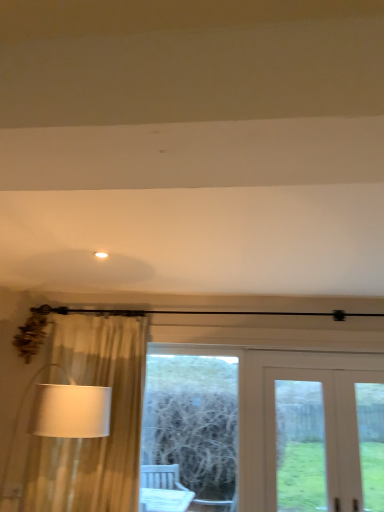
Image resolution: width=384 pixels, height=512 pixels. Identify the location of white wooden door at center. coord(306,420).

The width and height of the screenshot is (384, 512). What do you see at coordinates (306, 420) in the screenshot?
I see `white wooden door at center` at bounding box center [306, 420].

Identify the location of wooden frame at center. (190, 433).

Consider the image. Which of these two, white matte light fixture at upper center or white fabric lampshade at left, is bigger?

white fabric lampshade at left is bigger.

Do you think white matte light fixture at upper center is within white fabric lampshade at left, or outside of it?

white matte light fixture at upper center is spatially situated outside white fabric lampshade at left.

Is there a large distance between white matte light fixture at upper center and white fabric lampshade at left?

No, there isn't a large distance between white matte light fixture at upper center and white fabric lampshade at left.

From the image's perspective, which is below, white matte light fixture at upper center or white fabric lampshade at left?

white fabric lampshade at left, from the image's perspective.

Is white wooden door at center shorter than white fabric lampshade at left?

No.

The image size is (384, 512). Identify the location of table lamp on the left of white wooden door at center. (71, 411).

Is white wooden door at center outside of white fabric lampshade at left?

That's correct, white wooden door at center is outside of white fabric lampshade at left.

How different are the orientations of white fabric lampshade at left and wooden frame at center in degrees?

The facing directions of white fabric lampshade at left and wooden frame at center are 2.8 degrees apart.

Is there a large distance between white fabric lampshade at left and wooden frame at center?

Absolutely, white fabric lampshade at left is distant from wooden frame at center.

You are a GUI agent. You are given a task and a screenshot of the screen. Output one action in this format:
    pyautogui.click(x=<x>, y=<y>)
    Task: Click on the bay window below the white fabric lampshade at left (from the image's perspective)
    
    Given the screenshot: What is the action you would take?
    pyautogui.click(x=190, y=433)

Which is in front, white fabric lampshade at left or wooden frame at center?

white fabric lampshade at left is closer to the camera.

Is wooden frame at center facing away from white wooden door at center?

That's not correct — wooden frame at center is not looking away from white wooden door at center.

Considering the sizes of objects wooden frame at center and white wooden door at center in the image provided, who is shorter, wooden frame at center or white wooden door at center?

Standing shorter between the two is white wooden door at center.

Is point (213, 470) closer to camera compared to point (366, 381)?

No.

Between wooden frame at center and white matte light fixture at upper center, which one has smaller size?

With smaller size is white matte light fixture at upper center.

From a real-world perspective, is wooden frame at center physically above white matte light fixture at upper center?

Actually, wooden frame at center is physically below white matte light fixture at upper center in the real world.

Is wooden frame at center positioned in front of white matte light fixture at upper center?

No.

In the scene shown: Is wooden frame at center touching white matte light fixture at upper center?

wooden frame at center is not next to white matte light fixture at upper center, and they're not touching.

Based on the photo, does white matte light fixture at upper center have a lesser width compared to wooden frame at center?

Incorrect, the width of white matte light fixture at upper center is not less than that of wooden frame at center.

Does point (101, 255) appear closer or farther from the camera than point (217, 366)?

Point (101, 255) is closer to the camera than point (217, 366).

Does white matte light fixture at upper center have a smaller size compared to wooden frame at center?

Correct, white matte light fixture at upper center occupies less space than wooden frame at center.

Considering the relative sizes of white fabric lampshade at left and white matte light fixture at upper center in the image provided, is white fabric lampshade at left shorter than white matte light fixture at upper center?

No, white fabric lampshade at left is not shorter than white matte light fixture at upper center.

Is white fabric lampshade at left oriented away from white matte light fixture at upper center?

That's not correct — white fabric lampshade at left is not looking away from white matte light fixture at upper center.

From a real-world perspective, is white fabric lampshade at left above or below white matte light fixture at upper center?

Clearly, from a real-world perspective, white fabric lampshade at left is below white matte light fixture at upper center.

The image size is (384, 512). Identify the location of lighting above the white fabric lampshade at left (from a real-world perspective). (101, 255).

The image size is (384, 512). I want to click on door lying on the right of white fabric lampshade at left, so click(x=306, y=420).

Based on their spatial positions, is white wooden door at center or white fabric lampshade at left closer to white matte light fixture at upper center?

Among the two, white fabric lampshade at left is located nearer to white matte light fixture at upper center.

In the scene shown: When comparing their distances from white fabric lampshade at left, does white wooden door at center or white matte light fixture at upper center seem further?

white wooden door at center.

Estimate the real-world distances between objects in this image. Which object is further from wooden frame at center, white matte light fixture at upper center or white fabric lampshade at left?

The object further to wooden frame at center is white matte light fixture at upper center.

When comparing their distances from wooden frame at center, does white wooden door at center or white fabric lampshade at left seem closer?

Based on the image, white wooden door at center appears to be nearer to wooden frame at center.

When comparing their distances from white matte light fixture at upper center, does white wooden door at center or wooden frame at center seem further?

wooden frame at center.

Based on their spatial positions, is white matte light fixture at upper center or white wooden door at center further from wooden frame at center?

The object further to wooden frame at center is white matte light fixture at upper center.

From the image, which object appears to be nearer to white matte light fixture at upper center, wooden frame at center or white wooden door at center?

white wooden door at center is closer to white matte light fixture at upper center.

Looking at the image, which one is located closer to wooden frame at center, white fabric lampshade at left or white matte light fixture at upper center?

white fabric lampshade at left is positioned closer to the anchor wooden frame at center.

Where is `lighting situated between white fabric lampshade at left and white wooden door at center from left to right`? lighting situated between white fabric lampshade at left and white wooden door at center from left to right is located at coordinates (101, 255).

This screenshot has height=512, width=384. Identify the location of table lamp that lies between white matte light fixture at upper center and wooden frame at center from top to bottom. [71, 411].

This screenshot has height=512, width=384. Identify the location of bay window between white matte light fixture at upper center and white wooden door at center in the horizontal direction. (190, 433).

Find the location of a particular element. bay window between white fabric lampshade at left and white wooden door at center from left to right is located at coordinates (190, 433).